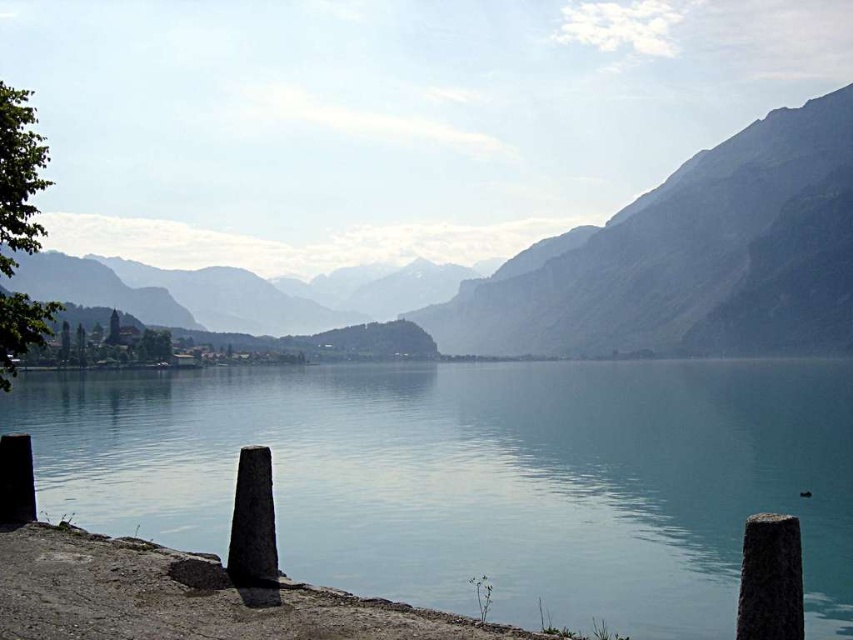
You are a hiker standing at the lakeside and want to take a photo of both the smooth concrete posts at lower center and the rocky gray mountain at center. Which object should you focus on first if you want to include both in your frame without moving your camera?

You should focus on the smooth concrete posts at lower center first because it is closer to you than the rocky gray mountain at center, allowing both to be in the same frame without moving the camera.

Based on the scene description, where are the smooth concrete posts at lower center located in the image?

The smooth concrete posts at lower center are located at point (x=477, y=477) in the image.